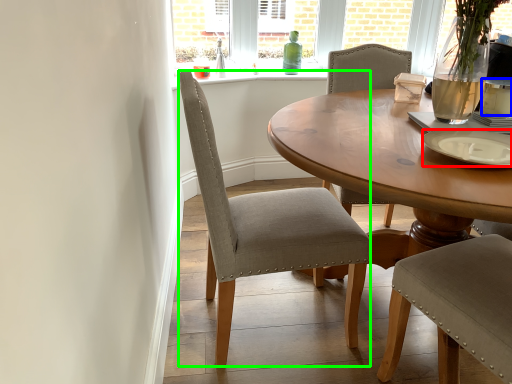
Question: Which is nearer to the plate (highlighted by a red box)? coffee cup (highlighted by a blue box) or chair (highlighted by a green box).

Choices:
 (A) coffee cup
 (B) chair

Answer: (A)